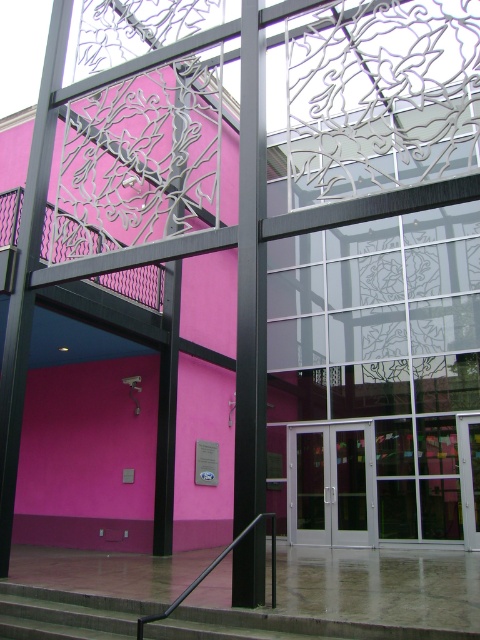
Between point (228, 628) and point (272, 538), which one is positioned in front?

Point (228, 628) is more forward.

Which of these two, concrete stairs at lower center or black metal/rail at lower center, stands taller?

concrete stairs at lower center is taller.

Identify the location of concrete stairs at lower center. (67, 612).

Is white glass door at center closer to camera compared to black metal/rail at lower center?

No.

Who is taller, white glass door at center or black metal/rail at lower center?

Standing taller between the two is white glass door at center.

Is point (326, 512) closer to viewer compared to point (252, 525)?

No, it is behind (252, 525).

The height and width of the screenshot is (640, 480). Find the location of `white glass door at center`. white glass door at center is located at coordinates (332, 484).

Between concrete stairs at lower center and white glass door at center, which one appears on the left side from the viewer's perspective?

From the viewer's perspective, concrete stairs at lower center appears more on the left side.

Does concrete stairs at lower center have a lesser width compared to white glass door at center?

In fact, concrete stairs at lower center might be wider than white glass door at center.

Is point (29, 600) less distant than point (367, 528)?

Yes, it is in front of point (367, 528).

At what (x,y) coordinates should I click in order to perform the action: click on concrete stairs at lower center. Please return your answer as a coordinate pair (x, y). The image size is (480, 640). Looking at the image, I should click on (67, 612).